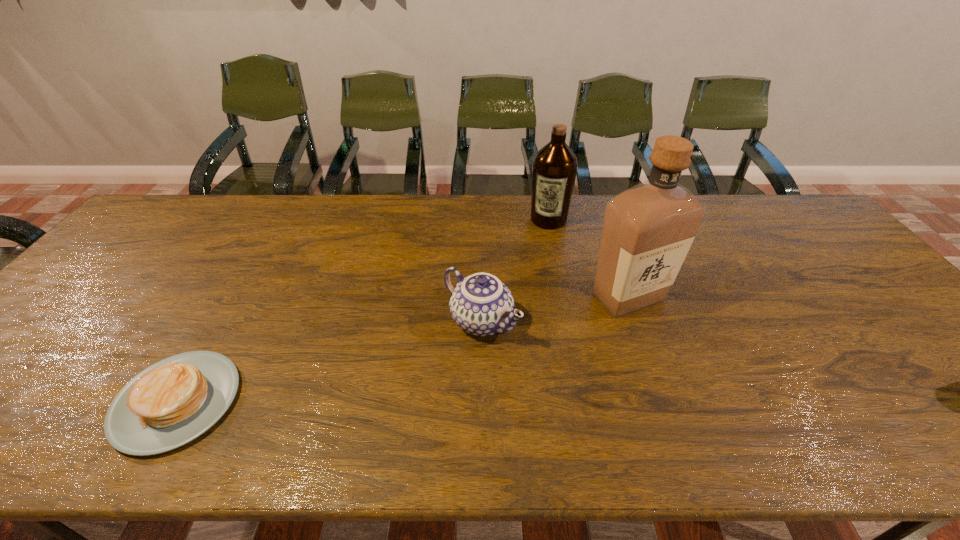
At what (x,y) coordinates should I click in order to perform the action: click on vacant point at the near edge. Please return your answer as a coordinate pair (x, y). Looking at the image, I should click on (477, 395).

Identify the location of free space at the left edge of the desktop. (38, 338).

You are a GUI agent. You are given a task and a screenshot of the screen. Output one action in this format:
    pyautogui.click(x=<x>, y=<y>)
    Task: Click on the vacant space at the far left corner
    
    Given the screenshot: What is the action you would take?
    pyautogui.click(x=211, y=195)

At what (x,y) coordinates should I click in order to perform the action: click on free space at the far right corner of the desktop. Please return your answer as a coordinate pair (x, y). Looking at the image, I should click on (783, 204).

Where is `unoccupied position between the liquor and the second tallest object`? The width and height of the screenshot is (960, 540). unoccupied position between the liquor and the second tallest object is located at coordinates (588, 258).

The image size is (960, 540). In order to click on empty space that is in between the chinaware and the farthest object in this screenshot , I will do `click(515, 271)`.

Identify the location of vacant space in between the second object from left to right and the tallest object. This screenshot has width=960, height=540. (555, 309).

Image resolution: width=960 pixels, height=540 pixels. Find the location of `the third closest object to the second shortest object`. the third closest object to the second shortest object is located at coordinates (174, 401).

Where is `the closest object to the olive oil`? the closest object to the olive oil is located at coordinates (647, 230).